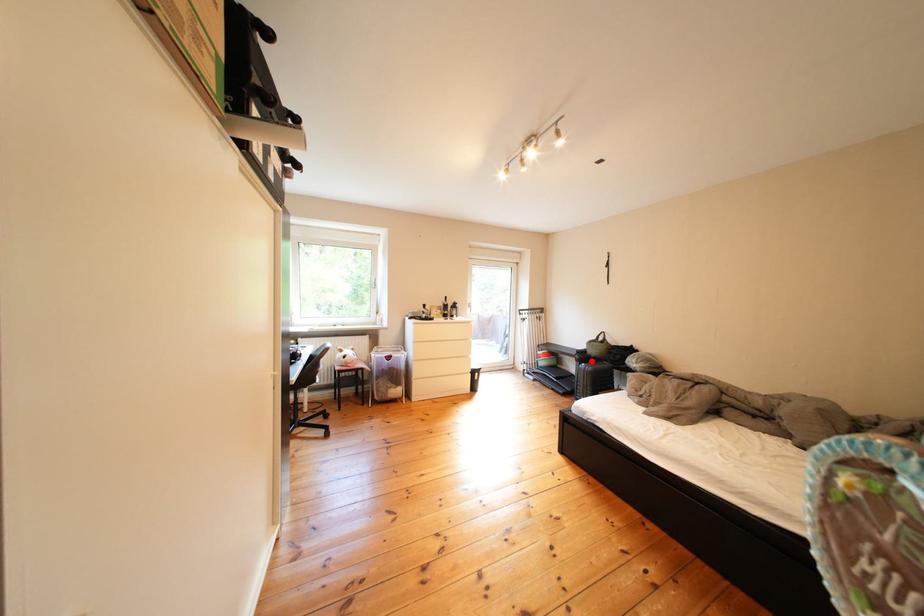
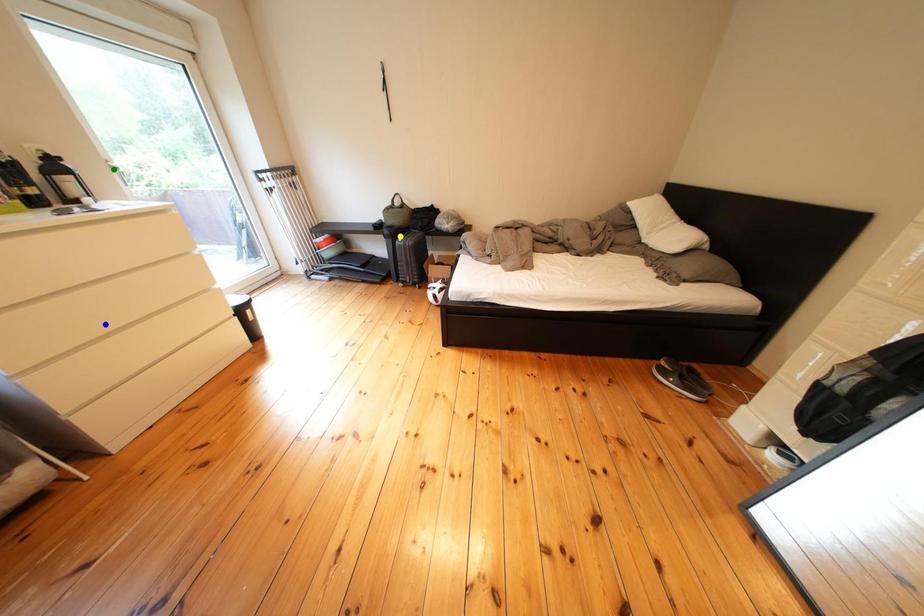
Question: I am providing you with two images of the same scene from different viewpoints. A red point is marked on the first image. You are given multiple points on the second image. In image 2, which mark is for the same physical point as the one in image 1?

Choices:
 (A) yellow point
 (B) blue point
 (C) green point

Answer: (A)